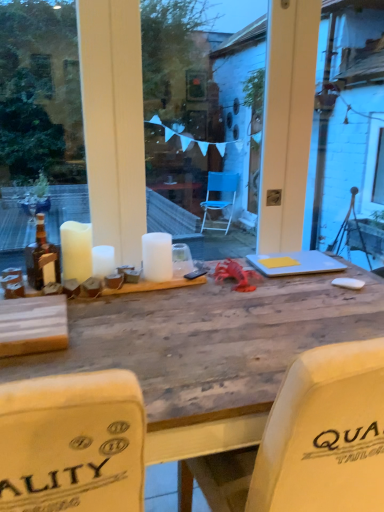
Question: From a real-world perspective, is white matte candle at center, marked as the 2th candle in a right-to-left arrangement, located higher than matte brown bottle at left?

Choices:
 (A) yes
 (B) no

Answer: (B)

Question: Considering the relative sizes of white matte candle at center, marked as the 2th candle in a right-to-left arrangement, and matte brown bottle at left in the image provided, is white matte candle at center, marked as the 2th candle in a right-to-left arrangement, shorter than matte brown bottle at left?

Choices:
 (A) no
 (B) yes

Answer: (B)

Question: From the image's perspective, does white matte candle at center, marked as the 2th candle in a right-to-left arrangement, appear lower than matte brown bottle at left?

Choices:
 (A) no
 (B) yes

Answer: (B)

Question: Considering the relative positions of white matte candle at center, which is counted as the second candle, starting from the left, and matte brown bottle at left in the image provided, is white matte candle at center, which is counted as the second candle, starting from the left, to the left of matte brown bottle at left from the viewer's perspective?

Choices:
 (A) no
 (B) yes

Answer: (A)

Question: Is matte brown bottle at left inside white matte candle at center, which is counted as the second candle, starting from the left?

Choices:
 (A) no
 (B) yes

Answer: (A)

Question: Can you see white matte candle at center, marked as the 2th candle in a right-to-left arrangement, touching matte brown bottle at left?

Choices:
 (A) no
 (B) yes

Answer: (A)

Question: Can you confirm if yellow paper at center is smaller than matte brown bottle at left?

Choices:
 (A) no
 (B) yes

Answer: (B)

Question: Does yellow paper at center appear on the right side of matte brown bottle at left?

Choices:
 (A) no
 (B) yes

Answer: (B)

Question: Is yellow paper at center shorter than matte brown bottle at left?

Choices:
 (A) no
 (B) yes

Answer: (B)

Question: Considering the relative sizes of yellow paper at center and matte brown bottle at left in the image provided, is yellow paper at center bigger than matte brown bottle at left?

Choices:
 (A) yes
 (B) no

Answer: (B)

Question: Is yellow paper at center outside of matte brown bottle at left?

Choices:
 (A) no
 (B) yes

Answer: (B)

Question: From the image's perspective, is yellow paper at center under matte brown bottle at left?

Choices:
 (A) no
 (B) yes

Answer: (B)

Question: Is white matte candle at center, the 1th candle in the right-to-left sequence, not close to white matte candle at left, which appears as the first candle when viewed from the left?

Choices:
 (A) yes
 (B) no

Answer: (B)